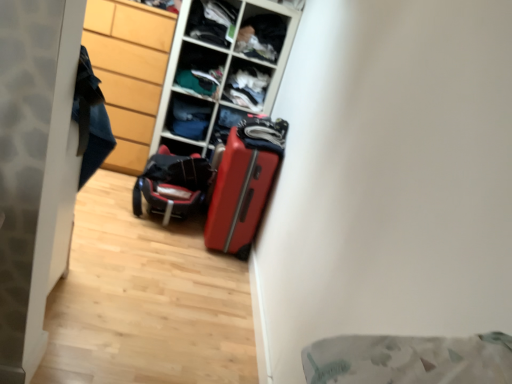
Where is `vacant area that is in front of black textured suitcase at center`? This screenshot has width=512, height=384. vacant area that is in front of black textured suitcase at center is located at coordinates (140, 242).